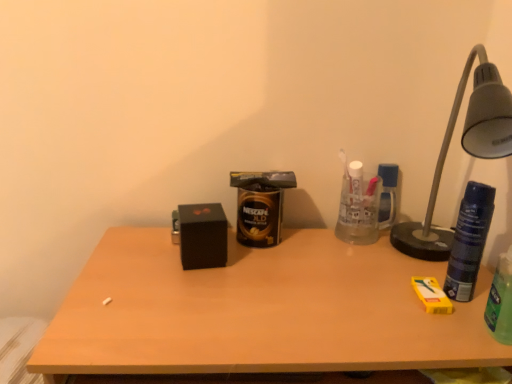
What are the coordinates of `blue textured can at right, arranged as the 2th beverage when viewed from the left` in the screenshot? It's located at (469, 241).

Between metallic gray lamp at right and green plastic bottle at right, which is counted as the third beverage, starting from the back, which one has less height?

green plastic bottle at right, which is counted as the third beverage, starting from the back, is shorter.

Is metallic gray lamp at right bigger than green plastic bottle at right, the first beverage in the front-to-back sequence?

Indeed, metallic gray lamp at right has a larger size compared to green plastic bottle at right, the first beverage in the front-to-back sequence.

Between metallic gray lamp at right and green plastic bottle at right, the first beverage in the front-to-back sequence, which one is positioned in front?

metallic gray lamp at right is more forward.

Based on their positions, is metallic gray lamp at right located to the left or right of green plastic bottle at right, which is counted as the third beverage, starting from the back?

In the image, metallic gray lamp at right appears on the left side of green plastic bottle at right, which is counted as the third beverage, starting from the back.

Can you confirm if blue textured can at right, which appears as the second beverage when viewed from the back, is bigger than green plastic bottle at right, which is the 3th beverage from left to right?

No.

Which of these two, blue textured can at right, arranged as the 2th beverage when viewed from the left, or green plastic bottle at right, which appears as the 1th beverage when viewed from the right, is wider?

green plastic bottle at right, which appears as the 1th beverage when viewed from the right.

From a real-world perspective, which beverage is the 1st one underneath the blue textured can at right, the 2th beverage in the right-to-left sequence? Please provide its 2D coordinates.

[(501, 301)]

In the image, is green plastic bottle at right, which is the 3th beverage from left to right, on the left side or the right side of metallic gray lamp at right?

From the image, it's evident that green plastic bottle at right, which is the 3th beverage from left to right, is to the right of metallic gray lamp at right.

Is point (488, 314) closer or farther from the camera than point (426, 238)?

Point (488, 314).

Considering the relative sizes of green plastic bottle at right, which is the 3th beverage from left to right, and metallic gray lamp at right in the image provided, is green plastic bottle at right, which is the 3th beverage from left to right, bigger than metallic gray lamp at right?

Actually, green plastic bottle at right, which is the 3th beverage from left to right, might be smaller than metallic gray lamp at right.

Is green plastic bottle at right, the first beverage in the front-to-back sequence, in front of or behind metallic gray lamp at right in the image?

green plastic bottle at right, the first beverage in the front-to-back sequence, is behind metallic gray lamp at right.

I want to click on lamp above the black matte box at center (from the image's perspective), so click(x=465, y=150).

Is black matte box at center bigger or smaller than metallic gray lamp at right?

In the image, black matte box at center appears to be smaller than metallic gray lamp at right.

Is black matte box at center shorter than metallic gray lamp at right?

Indeed, black matte box at center has a lesser height compared to metallic gray lamp at right.

From the image's perspective, is black matte box at center located above or below metallic gray lamp at right?

black matte box at center is below metallic gray lamp at right.

Is point (208, 206) closer or farther from the camera than point (480, 199)?

Point (208, 206) appears to be farther away from the viewer than point (480, 199).

Based on the photo, from a real-world perspective, which is physically above, black matte box at center or blue textured can at right, which appears as the second beverage when viewed from the back?

In real-world perspective, blue textured can at right, which appears as the second beverage when viewed from the back, is above.

Considering the positions of objects black matte box at center and blue textured can at right, the 2th beverage in the right-to-left sequence, in the image provided, who is in front, black matte box at center or blue textured can at right, the 2th beverage in the right-to-left sequence,?

Positioned in front is blue textured can at right, the 2th beverage in the right-to-left sequence.

Is blue textured can at right, the 2th beverage in the right-to-left sequence, at the back of black matte box at center?

No, blue textured can at right, the 2th beverage in the right-to-left sequence, is not at the back of black matte box at center.

What's the angular difference between metallic gray lamp at right and blue textured can at right, which appears as the second beverage when viewed from the back,'s facing directions?

0.00932 degrees separate the facing orientations of metallic gray lamp at right and blue textured can at right, which appears as the second beverage when viewed from the back.

Is metallic gray lamp at right to the left of blue textured can at right, the 2th beverage in the right-to-left sequence, from the viewer's perspective?

Correct, you'll find metallic gray lamp at right to the left of blue textured can at right, the 2th beverage in the right-to-left sequence.

Consider the image. Is metallic gray lamp at right facing towards blue textured can at right, which is the 2th beverage from front to back?

Yes, metallic gray lamp at right is aimed at blue textured can at right, which is the 2th beverage from front to back.

How distant is wooden desk at center from metallic gray lamp at right?

wooden desk at center is 12.98 inches away from metallic gray lamp at right.

Considering the relative sizes of wooden desk at center and metallic gray lamp at right in the image provided, is wooden desk at center wider than metallic gray lamp at right?

Yes, wooden desk at center is wider than metallic gray lamp at right.

From the image's perspective, between wooden desk at center and metallic gray lamp at right, which one is located above?

From the image's view, metallic gray lamp at right is above.

Does wooden desk at center have a smaller size compared to metallic gray lamp at right?

Result: Actually, wooden desk at center might be larger than metallic gray lamp at right.

Identify the location of lamp located on the left of green plastic bottle at right, which appears as the 1th beverage when viewed from the right. click(x=465, y=150).

Locate an element on the screen. The width and height of the screenshot is (512, 384). the 1st beverage positioned below the blue textured can at right, the 2th beverage in the right-to-left sequence (from a real-world perspective) is located at coordinates (501, 301).

Looking at the image, which one is located closer to black matte box at center, green plastic bottle at right, which appears as the 1th beverage when viewed from the right, or wooden desk at center?

wooden desk at center.

Estimate the real-world distances between objects in this image. Which object is further from black matte box at center, gold metallic can at center, the 1th beverage in the left-to-right sequence, or wooden desk at center?

wooden desk at center is positioned further to the anchor black matte box at center.

Looking at the image, which one is located further to metallic gray lamp at right, gold metallic can at center, the 1th beverage in the left-to-right sequence, or wooden desk at center?

gold metallic can at center, the 1th beverage in the left-to-right sequence, is further to metallic gray lamp at right.

From the image, which object appears to be nearer to blue textured can at right, the 2th beverage in the right-to-left sequence, wooden desk at center or black matte box at center?

Among the two, wooden desk at center is located nearer to blue textured can at right, the 2th beverage in the right-to-left sequence.

When comparing their distances from gold metallic can at center, the 1th beverage positioned from the back, does blue textured can at right, arranged as the 2th beverage when viewed from the left, or black matte box at center seem further?

blue textured can at right, arranged as the 2th beverage when viewed from the left.

Which object lies further to the anchor point green plastic bottle at right, which is the 3th beverage from left to right, blue textured can at right, which is the 2th beverage from front to back, or gold metallic can at center, arranged as the third beverage when viewed from the front?

Among the two, gold metallic can at center, arranged as the third beverage when viewed from the front, is located further to green plastic bottle at right, which is the 3th beverage from left to right.

Estimate the real-world distances between objects in this image. Which object is closer to blue textured can at right, which is the 2th beverage from front to back, gold metallic can at center, arranged as the third beverage when viewed from the front, or green plastic bottle at right, which is counted as the third beverage, starting from the back?

Among the two, green plastic bottle at right, which is counted as the third beverage, starting from the back, is located nearer to blue textured can at right, which is the 2th beverage from front to back.

When comparing their distances from gold metallic can at center, the 1th beverage positioned from the back, does green plastic bottle at right, which is counted as the third beverage, starting from the back, or wooden desk at center seem further?

Among the two, green plastic bottle at right, which is counted as the third beverage, starting from the back, is located further to gold metallic can at center, the 1th beverage positioned from the back.

I want to click on desk situated between black matte box at center and metallic gray lamp at right from left to right, so [x=258, y=311].

Locate an element on the screen. The height and width of the screenshot is (384, 512). desk between black matte box at center and blue textured can at right, arranged as the 2th beverage when viewed from the left is located at coordinates (258, 311).

Locate an element on the screen. The image size is (512, 384). lamp between black matte box at center and green plastic bottle at right, the first beverage in the front-to-back sequence, from left to right is located at coordinates (465, 150).

The width and height of the screenshot is (512, 384). In order to click on desk between gold metallic can at center, arranged as the third beverage when viewed from the front, and green plastic bottle at right, which appears as the 1th beverage when viewed from the right, in the horizontal direction in this screenshot , I will do `click(258, 311)`.